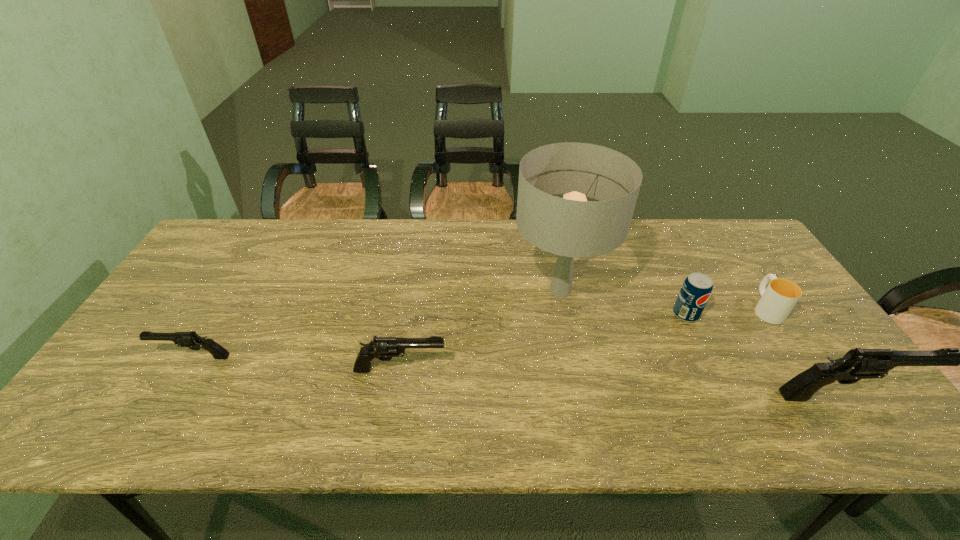
Where is `the leftmost object`? the leftmost object is located at coordinates (191, 340).

Find the location of a particular element. The image size is (960, 540). the farthest gun is located at coordinates (191, 340).

Locate an element on the screen. The width and height of the screenshot is (960, 540). the fifth object from right to left is located at coordinates (384, 348).

Identify the location of the second shortest gun. The width and height of the screenshot is (960, 540). (384, 348).

Where is `the nearest gun`? The height and width of the screenshot is (540, 960). the nearest gun is located at coordinates (856, 364).

Identify the location of the nearest object. (856, 364).

Locate an element on the screen. The image size is (960, 540). pop is located at coordinates (697, 287).

Locate an element on the screen. cup is located at coordinates (777, 301).

What are the coordinates of `lampshade` in the screenshot? It's located at (571, 227).

You are a GUI agent. You are given a task and a screenshot of the screen. Output one action in this format:
    pyautogui.click(x=<x>, y=<y>)
    Task: Click on the tallest object
    The width and height of the screenshot is (960, 540).
    Given the screenshot: What is the action you would take?
    pyautogui.click(x=571, y=227)